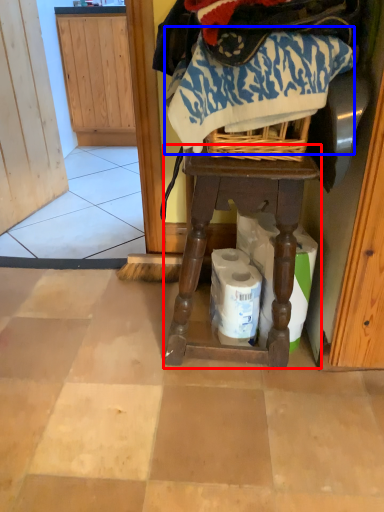
Question: Which of the following is the closest to the observer, furniture (highlighted by a red box) or clothing (highlighted by a blue box)?

Choices:
 (A) furniture
 (B) clothing

Answer: (B)